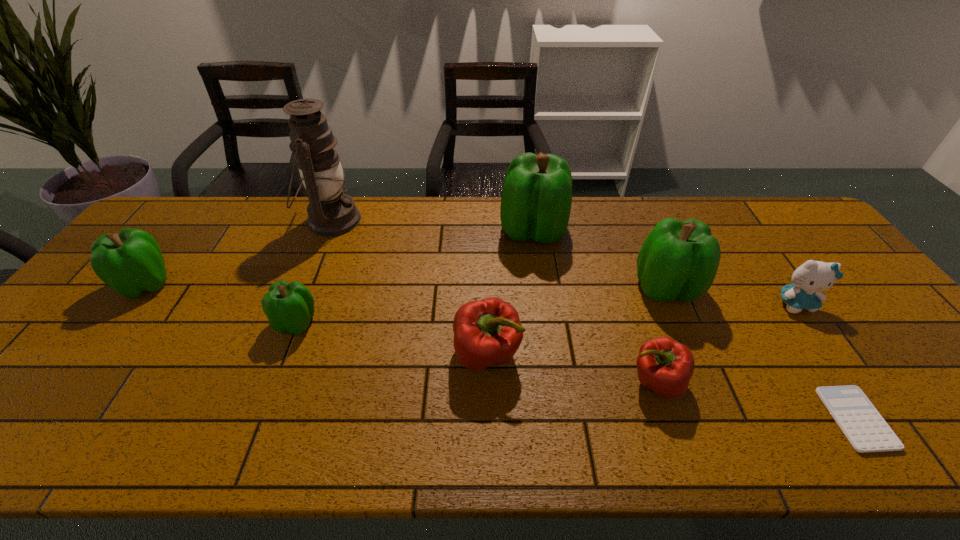
Locate an element on the screen. This screenshot has width=960, height=540. the fifth bell pepper from right to left is located at coordinates (289, 307).

Where is `the third green bell pepper from right to left`? The width and height of the screenshot is (960, 540). the third green bell pepper from right to left is located at coordinates (289, 307).

Locate an element on the screen. the smaller pink bell pepper is located at coordinates (664, 366).

Locate an element on the screen. the shortest object is located at coordinates (866, 430).

The height and width of the screenshot is (540, 960). In order to click on white calculator in this screenshot , I will do `click(866, 430)`.

The height and width of the screenshot is (540, 960). I want to click on vacant region located on the left of the oil lamp, so click(206, 220).

Locate an element on the screen. This screenshot has width=960, height=540. free region located 0.300m on the front of the farthest green bell pepper is located at coordinates (547, 331).

Locate an element on the screen. This screenshot has width=960, height=540. free space located 0.070m on the front of the rightmost green bell pepper is located at coordinates (685, 333).

At what (x,y) coordinates should I click in order to perform the action: click on free space located on the back of the leftmost green bell pepper. Please return your answer as a coordinate pair (x, y). Looking at the image, I should click on (214, 197).

Find the location of a particular element. vacant region located on the right of the left pink bell pepper is located at coordinates (660, 355).